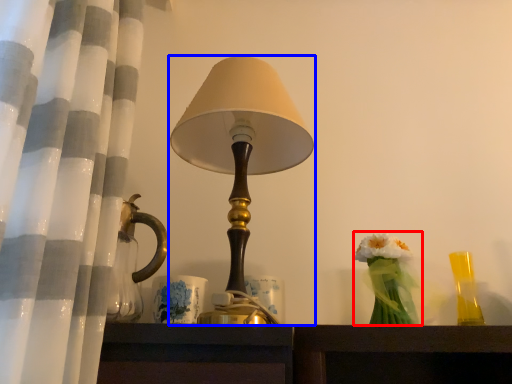
Question: Which point is further to the camera, floral arrangement (highlighted by a red box) or lamp (highlighted by a blue box)?

Choices:
 (A) floral arrangement
 (B) lamp

Answer: (A)